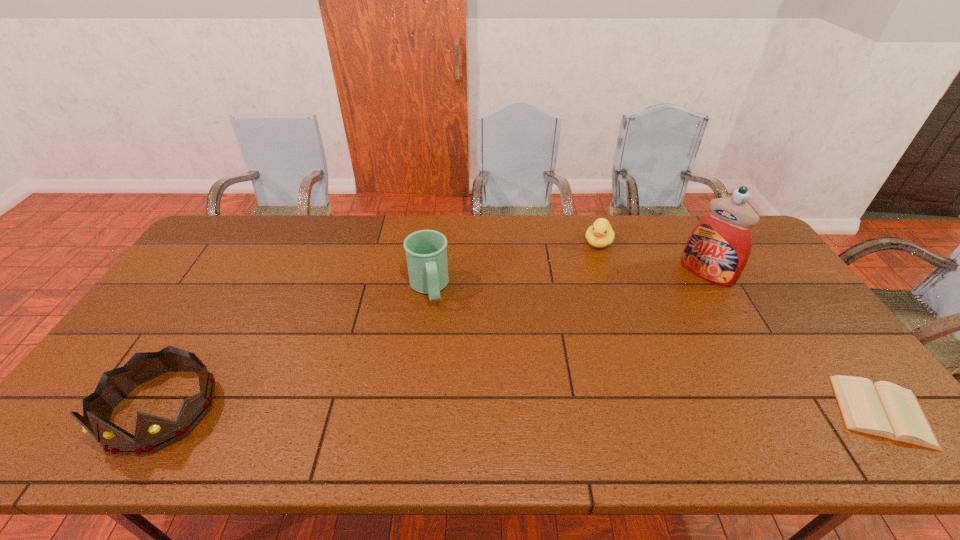
This screenshot has height=540, width=960. What are the coordinates of `free space at the far edge of the desktop` in the screenshot? It's located at (345, 228).

You are a GUI agent. You are given a task and a screenshot of the screen. Output one action in this format:
    pyautogui.click(x=<x>, y=<y>)
    Task: Click on the vacant space at the near edge of the desktop
    The height and width of the screenshot is (540, 960).
    Given the screenshot: What is the action you would take?
    pyautogui.click(x=340, y=393)

The height and width of the screenshot is (540, 960). Find the location of `free spot at the left edge of the desktop`. free spot at the left edge of the desktop is located at coordinates (165, 314).

Where is `blank space at the right edge of the desktop`? This screenshot has width=960, height=540. blank space at the right edge of the desktop is located at coordinates click(772, 278).

This screenshot has height=540, width=960. In the image, there is a desktop. Identify the location of vacant space at the near left corner. (140, 406).

Find the location of a particular element. free space between the detergent and the third object from left to right is located at coordinates (652, 258).

You are a GUI agent. You are given a task and a screenshot of the screen. Output one action in this format:
    pyautogui.click(x=<x>, y=<y>)
    Task: Click on the free area in between the tiara and the third tallest object
    
    Given the screenshot: What is the action you would take?
    pyautogui.click(x=295, y=349)

Find the location of `empty space between the third shortest object and the tiara`. empty space between the third shortest object and the tiara is located at coordinates (295, 349).

Identify the location of unoccupied position between the third shortest object and the leftmost object. (295, 349).

This screenshot has width=960, height=540. Find the location of `empty space between the tallest object and the third object from right to left`. empty space between the tallest object and the third object from right to left is located at coordinates (652, 258).